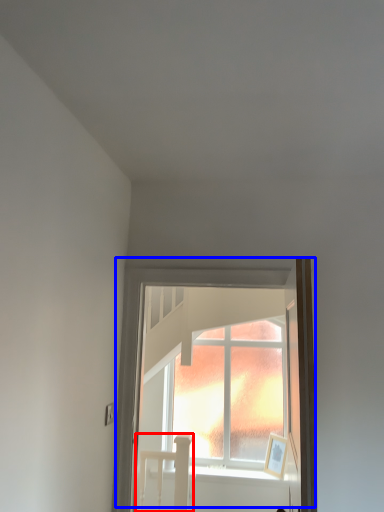
Question: Among these objects, which one is farthest to the camera, bed (highlighted by a red box) or window (highlighted by a blue box)?

Choices:
 (A) bed
 (B) window

Answer: (A)